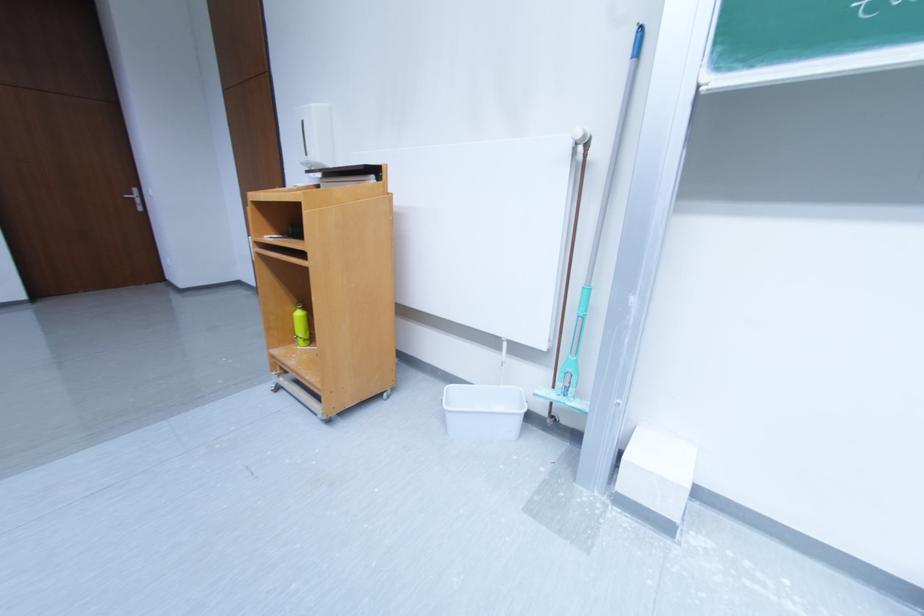
Locate an element on the screen. The height and width of the screenshot is (616, 924). white pipe knob is located at coordinates (580, 137).